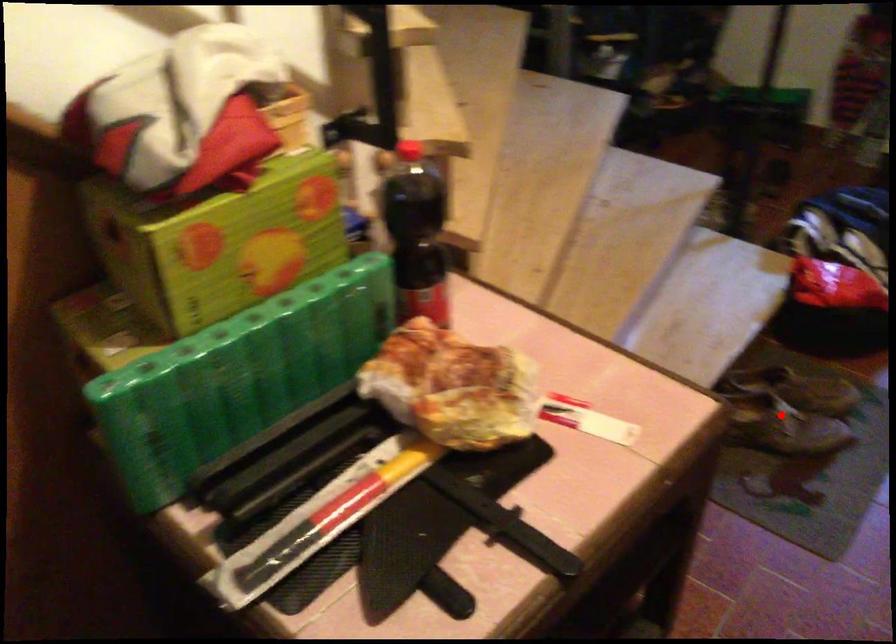
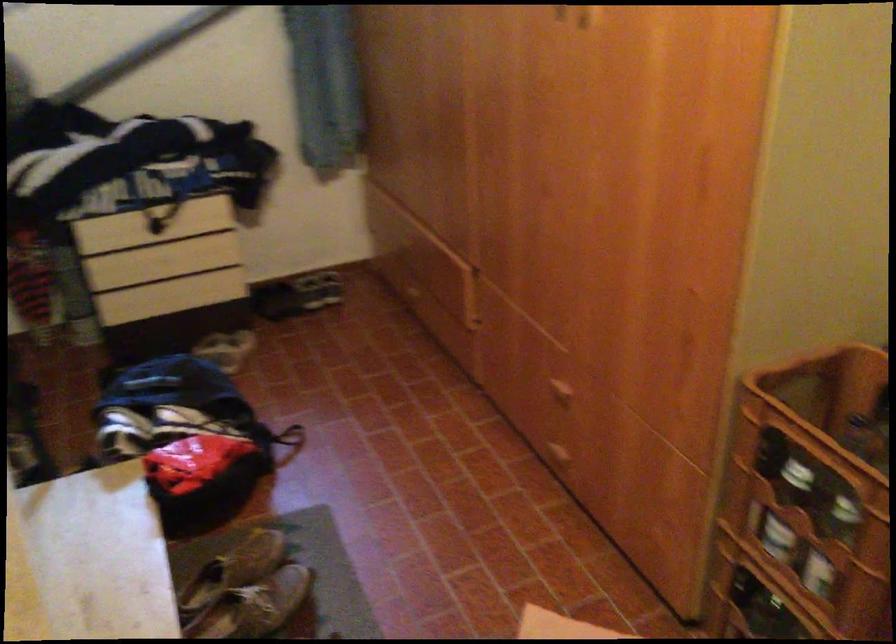
In the second image, find the point that corresponds to the highlighted location in the first image.

(244, 590)